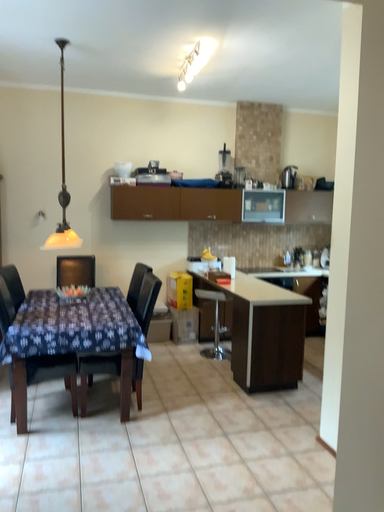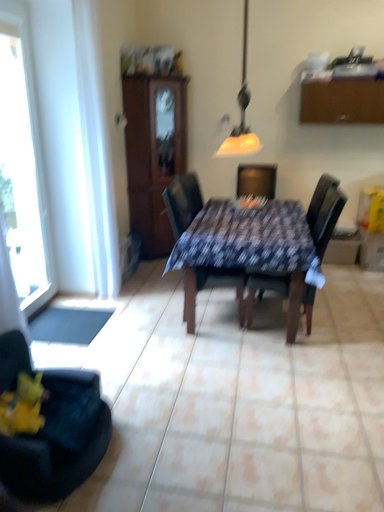
Question: Which way did the camera rotate in the video?

Choices:
 (A) rotated upward
 (B) rotated downward

Answer: (B)